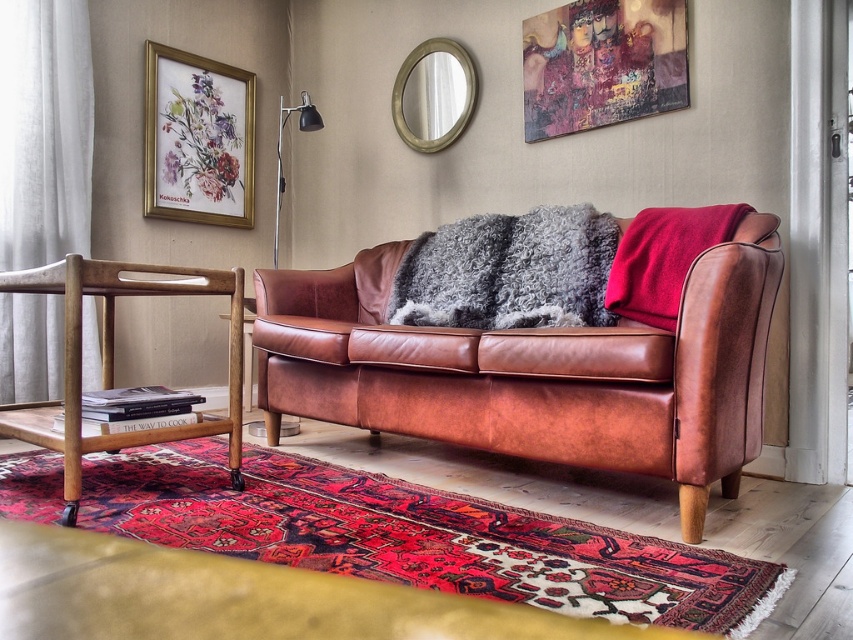
Is point (109, 294) closer to viewer compared to point (659, 224)?

Yes, point (109, 294) is closer to viewer.

Consider the image. Is wooden armchair at lower left below velvet red pillow at right?

Indeed, wooden armchair at lower left is positioned under velvet red pillow at right.

Is point (231, 385) positioned behind point (614, 308)?

No, (231, 385) is closer to viewer.

Locate an element on the screen. This screenshot has height=640, width=853. wooden armchair at lower left is located at coordinates (112, 356).

Does wooden armchair at lower left appear over gold-framed mirror at upper center?

Incorrect, wooden armchair at lower left is not positioned above gold-framed mirror at upper center.

Between wooden armchair at lower left and gold-framed mirror at upper center, which one appears on the right side from the viewer's perspective?

gold-framed mirror at upper center

Which is in front, point (56, 442) or point (431, 65)?

Positioned in front is point (56, 442).

I want to click on wooden armchair at lower left, so click(x=112, y=356).

In the scene shown: Is velvet red pillow at right bigger than gold-framed mirror at upper center?

Yes, velvet red pillow at right is bigger than gold-framed mirror at upper center.

The image size is (853, 640). I want to click on velvet red pillow at right, so click(x=663, y=259).